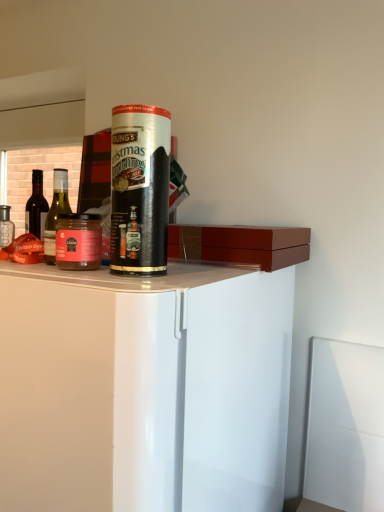
This screenshot has width=384, height=512. Find the location of `vacant space situated on the left part of transparent plastic straw at center`. vacant space situated on the left part of transparent plastic straw at center is located at coordinates (51, 269).